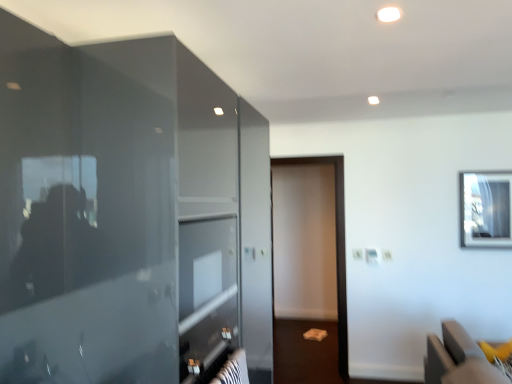
Question: In terms of height, does yellow fabric cushion at lower right look taller or shorter compared to clear glass window at upper right?

Choices:
 (A) tall
 (B) short

Answer: (B)

Question: In terms of width, does yellow fabric cushion at lower right look wider or thinner when compared to clear glass window at upper right?

Choices:
 (A) thin
 (B) wide

Answer: (B)

Question: Which object is the farthest from the glossy glass door at left?

Choices:
 (A) clear glass window at upper right
 (B) yellow fabric cushion at lower right
 (C) brown matte screen door at center

Answer: (A)

Question: Which object is positioned farthest from the glossy glass door at left?

Choices:
 (A) yellow fabric cushion at lower right
 (B) brown matte screen door at center
 (C) clear glass window at upper right

Answer: (C)